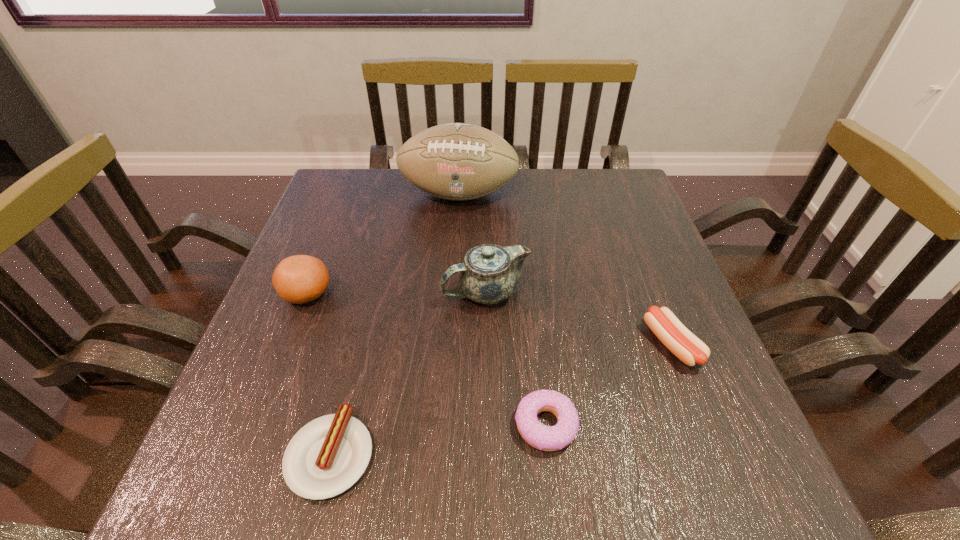
Image resolution: width=960 pixels, height=540 pixels. Find the location of `vacant area situated on the laces of the football (American)`. vacant area situated on the laces of the football (American) is located at coordinates (455, 253).

Identify the location of vacant space located from the spout of the second tallest object. Image resolution: width=960 pixels, height=540 pixels. (309, 292).

The image size is (960, 540). In order to click on vacant area situated from the spout of the second tallest object in this screenshot , I will do `click(332, 292)`.

Locate an element on the screen. Image resolution: width=960 pixels, height=540 pixels. free location located 0.080m from the spout of the second tallest object is located at coordinates (405, 292).

At what (x,y) coordinates should I click in order to perform the action: click on vacant space located 0.070m on the back of the leftmost object. Please return your answer as a coordinate pair (x, y). This screenshot has width=960, height=540. Looking at the image, I should click on (322, 255).

Identify the location of free point located 0.160m on the left of the right sausage. (564, 343).

At what (x,y) coordinates should I click in order to perform the action: click on vacant point located 0.190m on the back of the doughnut. Please return your answer as a coordinate pair (x, y). Looking at the image, I should click on (534, 315).

Find the location of a particular element. vacant space located 0.190m on the back of the shorter sausage is located at coordinates (362, 327).

The image size is (960, 540). In order to click on object at the far edge in this screenshot , I will do `click(455, 161)`.

You are a GUI agent. You are given a task and a screenshot of the screen. Output one action in this format:
    pyautogui.click(x=<x>, y=<y>)
    Task: Click on the doughnut present at the near edge
    
    Given the screenshot: What is the action you would take?
    pyautogui.click(x=546, y=438)